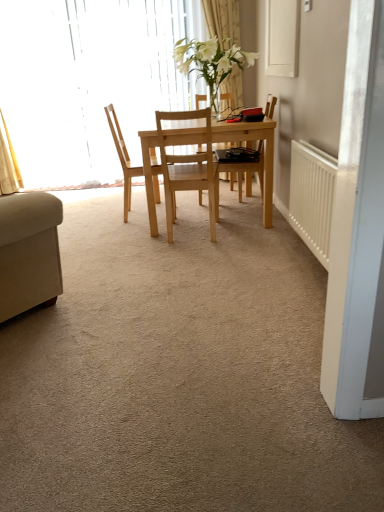
Question: Looking at the image, does translucent glass window at upper left seem bigger or smaller compared to natural wood chair at center, positioned as the 1th chair in right-to-left order?

Choices:
 (A) big
 (B) small

Answer: (A)

Question: Would you say translucent glass window at upper left is inside or outside natural wood chair at center, arranged as the 2th chair when viewed from the left?

Choices:
 (A) inside
 (B) outside

Answer: (B)

Question: Considering the real-world distances, which object is closest to the white glossy vase at center?

Choices:
 (A) natural wood chair at center, positioned as the 1th chair in right-to-left order
 (B) light wood table at center
 (C) white plastic radiator at right
 (D) white sheer curtain at upper center
 (E) translucent glass window at upper left

Answer: (B)

Question: Considering the real-world distances, which object is farthest from the white glossy vase at center?

Choices:
 (A) white plastic radiator at right
 (B) white sheer curtain at upper center
 (C) natural wood chair at center, the 1th chair when ordered from left to right
 (D) natural wood chair at center, positioned as the 1th chair in right-to-left order
 (E) light wood table at center

Answer: (A)